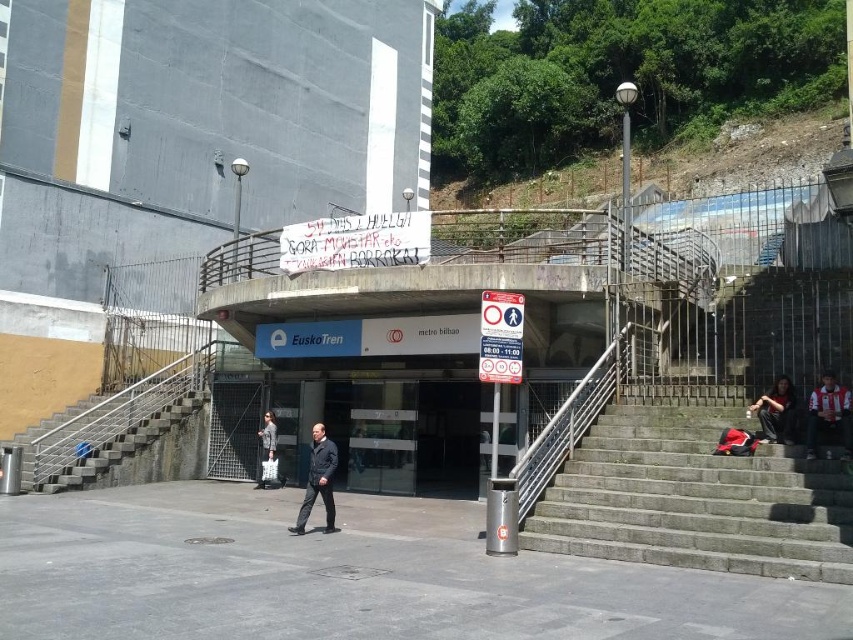
Consider the image. Who is shorter, gray concrete stairs at lower right or dark blue jeans at lower right?

dark blue jeans at lower right is shorter.

Can you confirm if gray concrete stairs at lower right is shorter than dark blue jeans at lower right?

In fact, gray concrete stairs at lower right may be taller than dark blue jeans at lower right.

What do you see at coordinates (695, 493) in the screenshot? The image size is (853, 640). I see `gray concrete stairs at lower right` at bounding box center [695, 493].

Image resolution: width=853 pixels, height=640 pixels. I want to click on gray concrete stairs at lower right, so click(695, 493).

Based on the photo, does gray concrete stairs at lower right have a greater height compared to yellow concrete stairs at lower left?

No, gray concrete stairs at lower right is not taller than yellow concrete stairs at lower left.

Between gray concrete stairs at lower right and yellow concrete stairs at lower left, which one is positioned lower?

Positioned lower is yellow concrete stairs at lower left.

The width and height of the screenshot is (853, 640). What are the coordinates of `gray concrete stairs at lower right` in the screenshot? It's located at (695, 493).

Does yellow concrete stairs at lower left have a lesser height compared to dark blue jeans at lower right?

No.

Is point (106, 448) positioned behind point (766, 410)?

Yes, it is.

Find the location of a particular element. This screenshot has height=640, width=853. yellow concrete stairs at lower left is located at coordinates (114, 426).